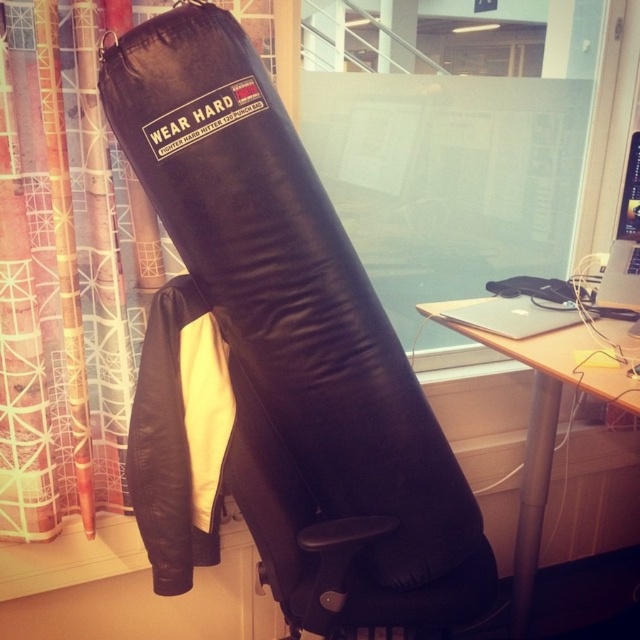
Does black leather boxing glove at center have a greater height compared to textured fabric curtain at left?

Indeed, black leather boxing glove at center has a greater height compared to textured fabric curtain at left.

Does black leather boxing glove at center have a larger size compared to textured fabric curtain at left?

Yes.

Where is `black leather boxing glove at center`? black leather boxing glove at center is located at coordinates (280, 356).

This screenshot has height=640, width=640. Identify the location of black leather boxing glove at center. (280, 356).

Consider the image. Does black leather boxing glove at center have a greater width compared to wooden desk at center?

Indeed, black leather boxing glove at center has a greater width compared to wooden desk at center.

Is black leather boxing glove at center to the right of wooden desk at center from the viewer's perspective?

Incorrect, black leather boxing glove at center is not on the right side of wooden desk at center.

Where is `black leather boxing glove at center`? black leather boxing glove at center is located at coordinates (280, 356).

Image resolution: width=640 pixels, height=640 pixels. What do you see at coordinates (60, 275) in the screenshot?
I see `textured fabric curtain at left` at bounding box center [60, 275].

How distant is textured fabric curtain at left from wooden desk at center?

The distance of textured fabric curtain at left from wooden desk at center is 34.86 inches.

Measure the distance between point (99, 401) and camera.

Point (99, 401) is 1.45 meters away from camera.

Locate an element on the screen. textured fabric curtain at left is located at coordinates (60, 275).